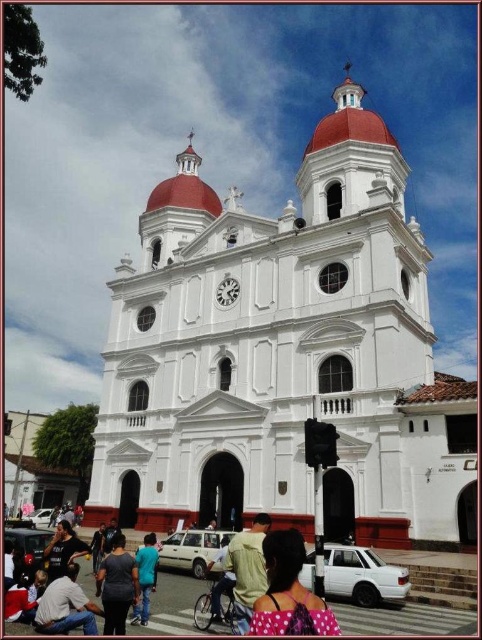
You are standing in front of the church and see the polka dot fabric at lower center. Where exactly is it located in relation to the church?

The polka dot fabric at lower center is located at the coordinates point (289, 593) relative to the church.

You are standing on the street in front of the white smooth church at center. You see a person wearing a dark blue shirt at lower left. In which direction should you walk to reach the person?

You should walk to the left because the dark blue shirt at lower left is positioned to the left of the white smooth church at center.